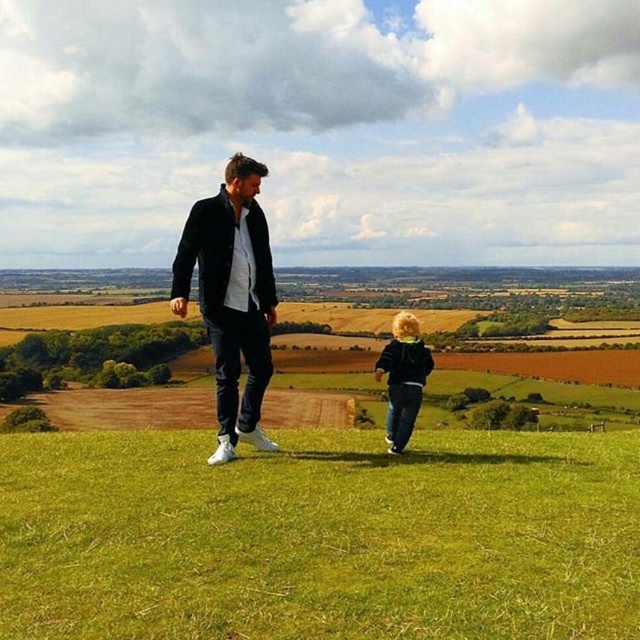
You are standing at the point marked as point (218, 620) and want to walk to the point marked as point (378, 362). Which direction should you move to get closer to your destination?

You should move away from the camera because point (218, 620) is closer to the camera than point (378, 362).

You are a tailor measuring jackets for a customer. You see the black matte jacket at center and the matte black hoodie at center in the image. Which one has a smaller width?

The black matte jacket at center has a smaller width than the matte black hoodie at center.

You are standing at the edge of the grassy hill where the two people are walking. You want to walk towards the green grass at center. Which direction should you move relative to the black matte jacket at center?

The green grass at center is located to the right of the black matte jacket at center. Therefore, you should move towards the right side of the black matte jacket at center to reach the green grass at center.